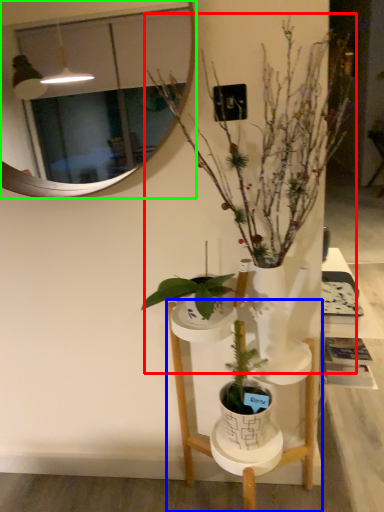
Question: Estimate the real-world distances between objects in this image. Which object is closer to houseplant (highlighted by a red box), furniture (highlighted by a blue box) or mirror (highlighted by a green box)?

Choices:
 (A) furniture
 (B) mirror

Answer: (B)